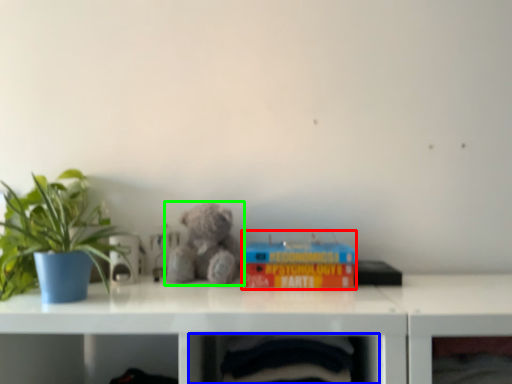
Question: Which object is the farthest from toy (highlighted by a red box)? Choose among these: shelf (highlighted by a blue box) or teddy bear (highlighted by a green box).

Choices:
 (A) shelf
 (B) teddy bear

Answer: (A)